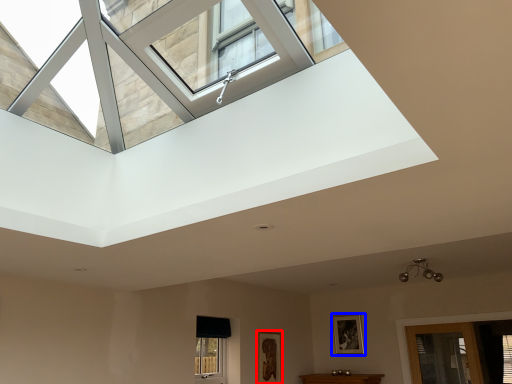
Question: Which point is closer to the camera, picture frame (highlighted by a red box) or picture frame (highlighted by a blue box)?

Choices:
 (A) picture frame
 (B) picture frame

Answer: (A)